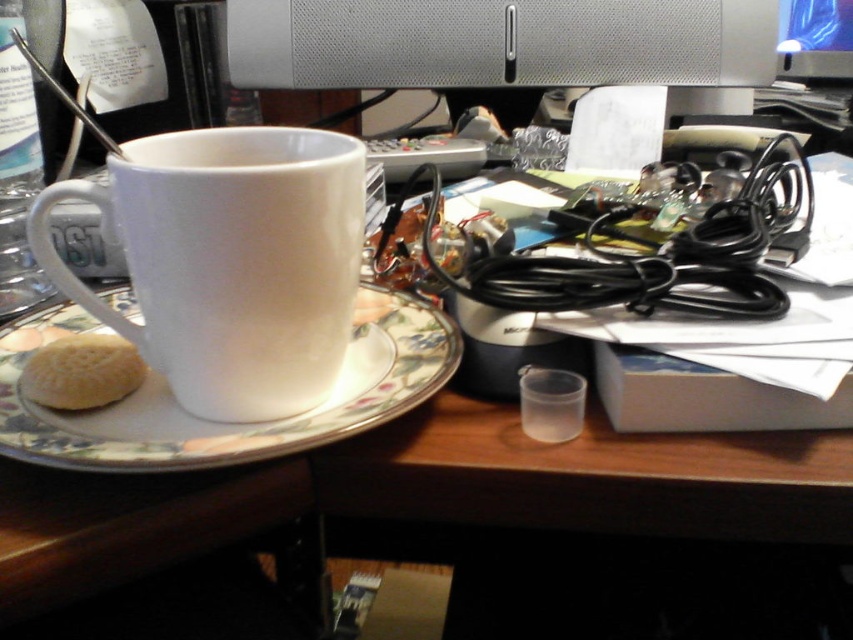
You are organizing the desk and want to place a new item between the porcelain saucer at center and the white matte biscuit at lower left. Based on their positions, where should you place the new item?

The porcelain saucer at center is in front of the white matte biscuit at lower left, so you should place the new item behind the porcelain saucer at center but in front of the white matte biscuit at lower left to position it between them.

You are organizing the desk and need to move the white matte mug at center and the satin silver computer monitor at upper center. Which object is closer to the left edge of the desk?

The white matte mug at center is closer to the left edge of the desk because it is positioned on the left side of the satin silver computer monitor at upper center.

You are organizing the desk items and need to place the white matte mug at center and the porcelain saucer at center into a drawer. The drawer has limited space. Based on their sizes, which item should you place first to ensure both fit?

The white matte mug at center occupies less space than the porcelain saucer at center, so you should place the porcelain saucer at center first to ensure both items fit into the drawer.